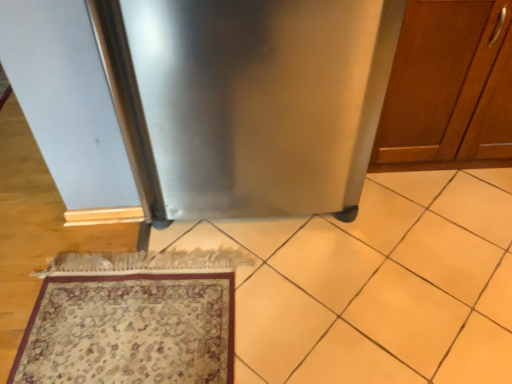
Question: From a real-world perspective, is wooden cabinet at right located higher than carpeted rug at lower left?

Choices:
 (A) no
 (B) yes

Answer: (B)

Question: Is the surface of wooden cabinet at right in direct contact with carpeted rug at lower left?

Choices:
 (A) no
 (B) yes

Answer: (A)

Question: Considering the relative sizes of wooden cabinet at right and carpeted rug at lower left in the image provided, is wooden cabinet at right taller than carpeted rug at lower left?

Choices:
 (A) yes
 (B) no

Answer: (A)

Question: Is carpeted rug at lower left located within wooden cabinet at right?

Choices:
 (A) no
 (B) yes

Answer: (A)

Question: Does wooden cabinet at right have a greater width compared to carpeted rug at lower left?

Choices:
 (A) no
 (B) yes

Answer: (A)

Question: From the image's perspective, is wooden cabinet at right on top of carpeted rug at lower left?

Choices:
 (A) yes
 (B) no

Answer: (A)

Question: Can you confirm if carpeted rug at lower left is bigger than stainless steel refrigerator at center?

Choices:
 (A) yes
 (B) no

Answer: (B)

Question: Is carpeted rug at lower left positioned with its back to stainless steel refrigerator at center?

Choices:
 (A) no
 (B) yes

Answer: (A)

Question: Does carpeted rug at lower left have a greater width compared to stainless steel refrigerator at center?

Choices:
 (A) yes
 (B) no

Answer: (B)

Question: Does carpeted rug at lower left come in front of stainless steel refrigerator at center?

Choices:
 (A) yes
 (B) no

Answer: (B)

Question: Can you confirm if carpeted rug at lower left is smaller than stainless steel refrigerator at center?

Choices:
 (A) no
 (B) yes

Answer: (B)

Question: From a real-world perspective, is carpeted rug at lower left physically below stainless steel refrigerator at center?

Choices:
 (A) no
 (B) yes

Answer: (B)

Question: Considering the relative sizes of wooden cabinet at right and stainless steel refrigerator at center in the image provided, is wooden cabinet at right shorter than stainless steel refrigerator at center?

Choices:
 (A) no
 (B) yes

Answer: (B)